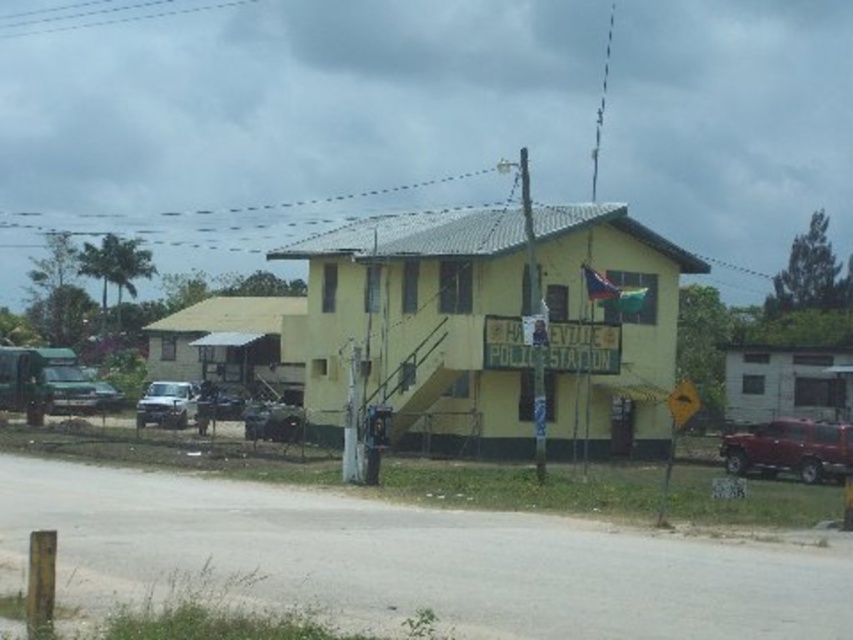
You are standing at the entrance of the Hollywood Police Station and want to hail the shiny red truck at right. In which direction should you walk to reach it?

The shiny red truck at right is located at point 0.703 in the x coordinate and 0.927 in the y coordinate. Since the truck is at a higher x value than the entrance, you should walk to the right to reach it.